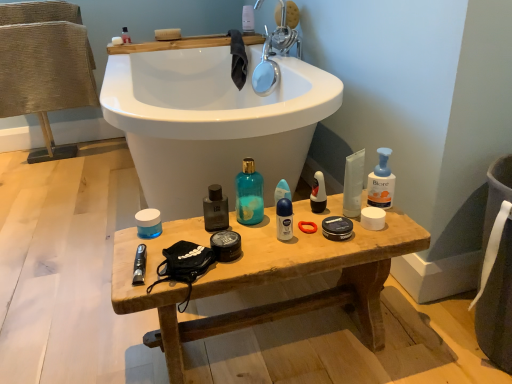
The image size is (512, 384). Find the location of `vacant space in front of teal glass bottle at center, arranged as the third cleaning product when viewed from the right`. vacant space in front of teal glass bottle at center, arranged as the third cleaning product when viewed from the right is located at coordinates (265, 241).